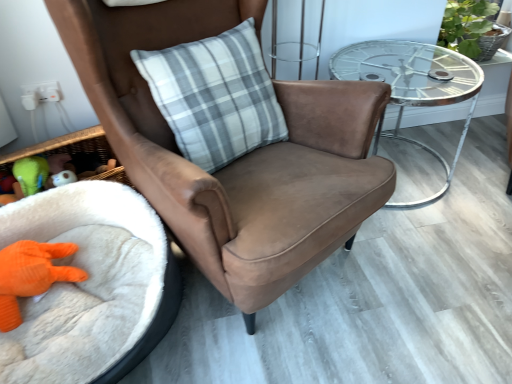
Question: Is green leafy plant at upper right far away from gray plaid pillow at center?

Choices:
 (A) no
 (B) yes

Answer: (B)

Question: From the image's perspective, is green leafy plant at upper right under gray plaid pillow at center?

Choices:
 (A) yes
 (B) no

Answer: (B)

Question: Can you confirm if green leafy plant at upper right is positioned to the left of gray plaid pillow at center?

Choices:
 (A) yes
 (B) no

Answer: (B)

Question: Is green leafy plant at upper right wider than gray plaid pillow at center?

Choices:
 (A) no
 (B) yes

Answer: (B)

Question: Considering the relative positions of green leafy plant at upper right and gray plaid pillow at center in the image provided, is green leafy plant at upper right behind gray plaid pillow at center?

Choices:
 (A) no
 (B) yes

Answer: (B)

Question: Would you say green leafy plant at upper right contains gray plaid pillow at center?

Choices:
 (A) no
 (B) yes

Answer: (A)

Question: Is green rubber duck at lower left, the 1th toy when ordered from top to bottom, smaller than orange knitted toy at lower left, the first toy in the bottom-to-top sequence?

Choices:
 (A) no
 (B) yes

Answer: (B)

Question: Is green rubber duck at lower left, placed as the second toy when sorted from bottom to top, looking in the opposite direction of orange knitted toy at lower left, the first toy in the bottom-to-top sequence?

Choices:
 (A) yes
 (B) no

Answer: (B)

Question: From the image's perspective, is green rubber duck at lower left, the 1th toy when ordered from top to bottom, under orange knitted toy at lower left, the first toy in the bottom-to-top sequence?

Choices:
 (A) yes
 (B) no

Answer: (B)

Question: Does green rubber duck at lower left, placed as the second toy when sorted from bottom to top, turn towards orange knitted toy at lower left, the 2th toy positioned from the top?

Choices:
 (A) no
 (B) yes

Answer: (B)

Question: Is green rubber duck at lower left, placed as the second toy when sorted from bottom to top, outside of orange knitted toy at lower left, the 2th toy positioned from the top?

Choices:
 (A) yes
 (B) no

Answer: (A)

Question: Can you confirm if green rubber duck at lower left, placed as the second toy when sorted from bottom to top, is positioned to the right of orange knitted toy at lower left, the first toy in the bottom-to-top sequence?

Choices:
 (A) no
 (B) yes

Answer: (A)

Question: From the image's perspective, is white fluffy infant bed at lower left located above gray plaid pillow at center?

Choices:
 (A) yes
 (B) no

Answer: (B)